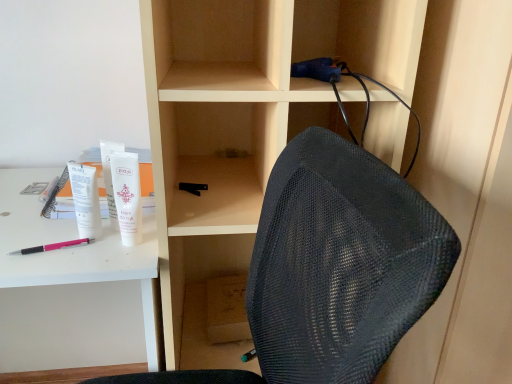
You are a GUI agent. You are given a task and a screenshot of the screen. Output one action in this format:
    pyautogui.click(x=<x>, y=<y>)
    Task: Click on the vacant area situated to the left side of white matte tube at upper left, marked as the 4th stationery in a top-to-bottom arrangement
    
    Given the screenshot: What is the action you would take?
    pyautogui.click(x=34, y=225)